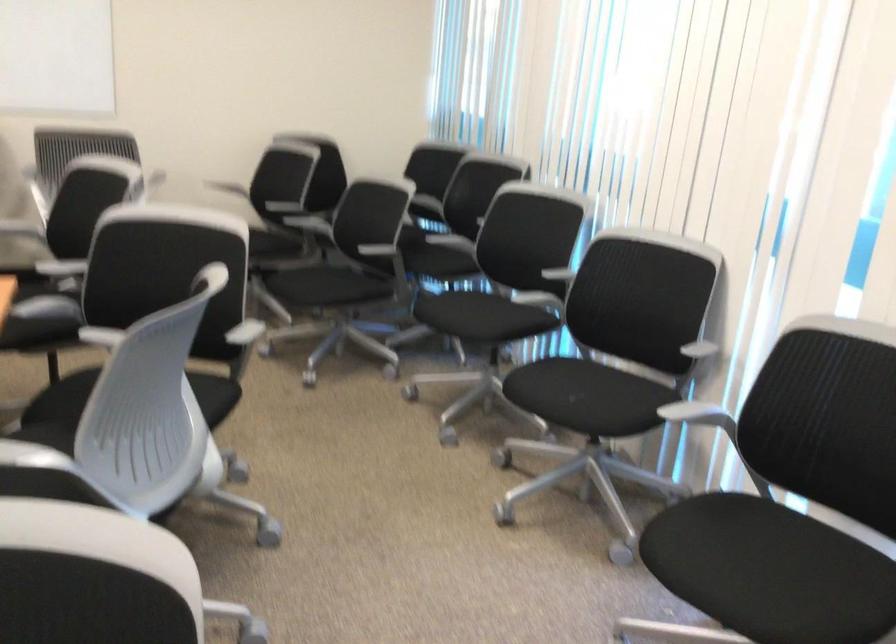
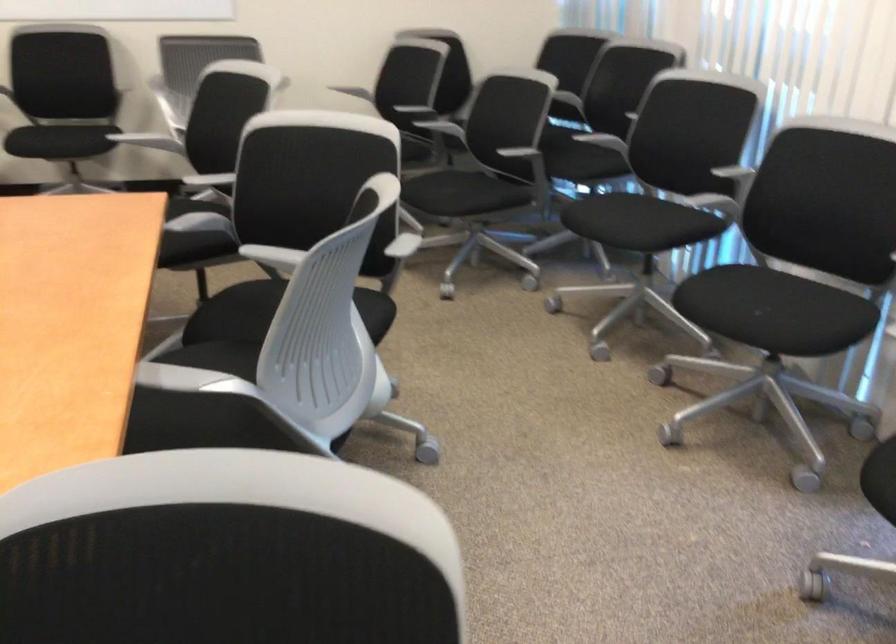
Where in the second image is the point corresponding to [467,319] from the first image?

(624, 221)